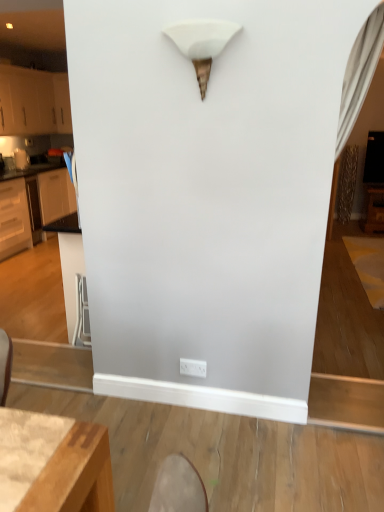
Question: Considering the positions of metallic silver swivel chair at lower left and white plastic electric outlet at lower center in the image, is metallic silver swivel chair at lower left bigger or smaller than white plastic electric outlet at lower center?

Choices:
 (A) small
 (B) big

Answer: (B)

Question: Is metallic silver swivel chair at lower left in front of or behind white plastic electric outlet at lower center in the image?

Choices:
 (A) behind
 (B) front

Answer: (A)

Question: Which is farther from the white matte cone at upper center?

Choices:
 (A) brushed metal toaster at left
 (B) white plastic electric outlet at lower center
 (C) metallic silver swivel chair at lower left
 (D) white glossy cabinets at left, which appears as the second cabinetry when viewed from the top
 (E) white matte cabinet at left, the 1th cabinetry viewed from the top

Answer: (E)

Question: Considering the real-world distances, which object is closest to the white matte cabinet at left, the 1th cabinetry viewed from the top?

Choices:
 (A) white plastic electric outlet at lower center
 (B) metallic silver swivel chair at lower left
 (C) white matte cone at upper center
 (D) white glossy cabinets at left, which appears as the second cabinetry when viewed from the top
 (E) brushed metal toaster at left

Answer: (E)